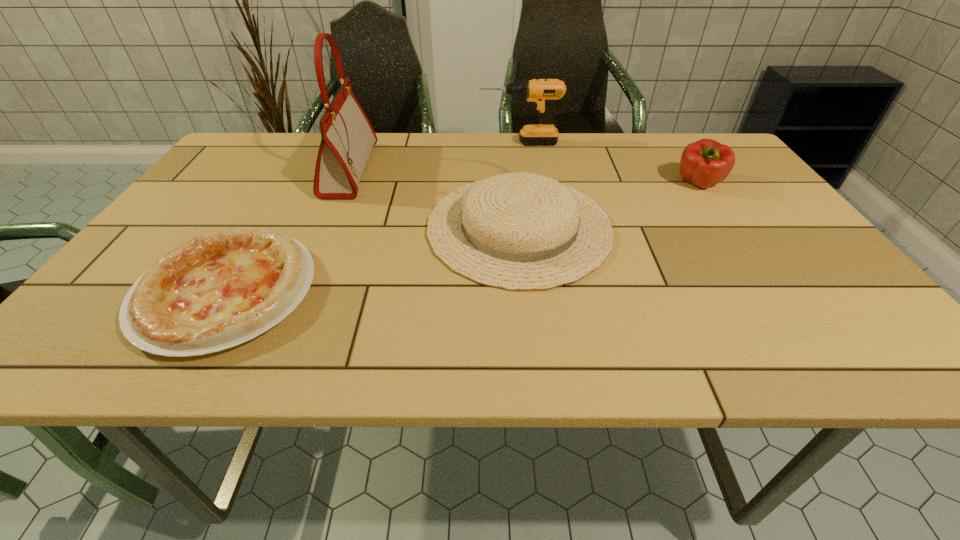
The width and height of the screenshot is (960, 540). Find the location of `object positioned at the far right corner`. object positioned at the far right corner is located at coordinates (706, 162).

In order to click on free space at the far edge in this screenshot , I will do `click(601, 167)`.

This screenshot has height=540, width=960. In the image, there is a desktop. What are the coordinates of `vacant space at the near edge` in the screenshot? It's located at (607, 328).

I want to click on free point at the left edge, so click(x=142, y=255).

Locate an element on the screen. vacant region at the right edge is located at coordinates (773, 266).

The height and width of the screenshot is (540, 960). What are the coordinates of `free space at the near left corner of the desktop` in the screenshot? It's located at (124, 340).

Where is `free space between the sunhat and the handbag`? free space between the sunhat and the handbag is located at coordinates (435, 199).

At what (x,y) coordinates should I click in order to perform the action: click on vacant point located between the bell pepper and the drill. Please return your answer as a coordinate pair (x, y). Looking at the image, I should click on (610, 164).

Where is `vacant space that's between the second tallest object and the shortest object`? Image resolution: width=960 pixels, height=540 pixels. vacant space that's between the second tallest object and the shortest object is located at coordinates (372, 218).

Find the location of a particular element. unoccupied position between the fourth tallest object and the shortest object is located at coordinates pyautogui.click(x=372, y=260).